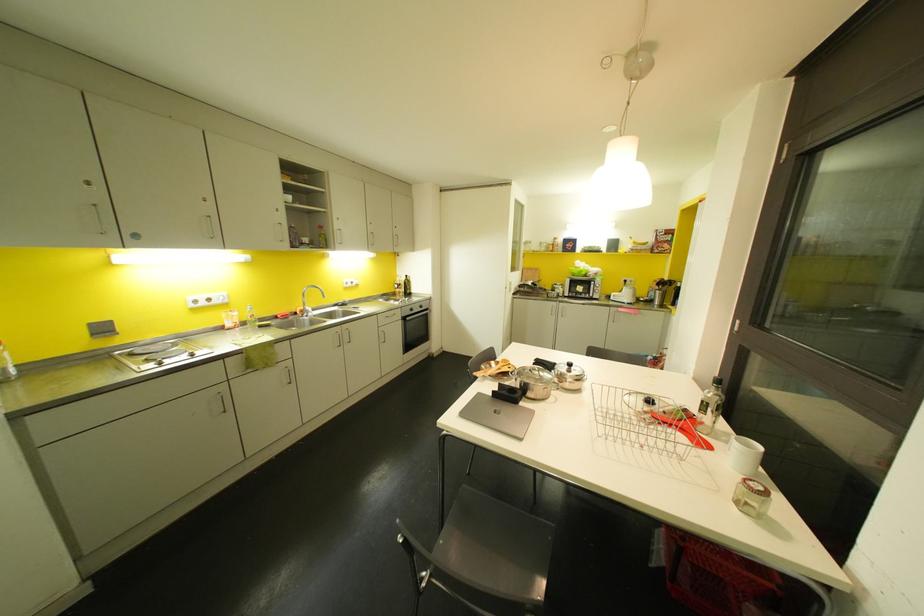
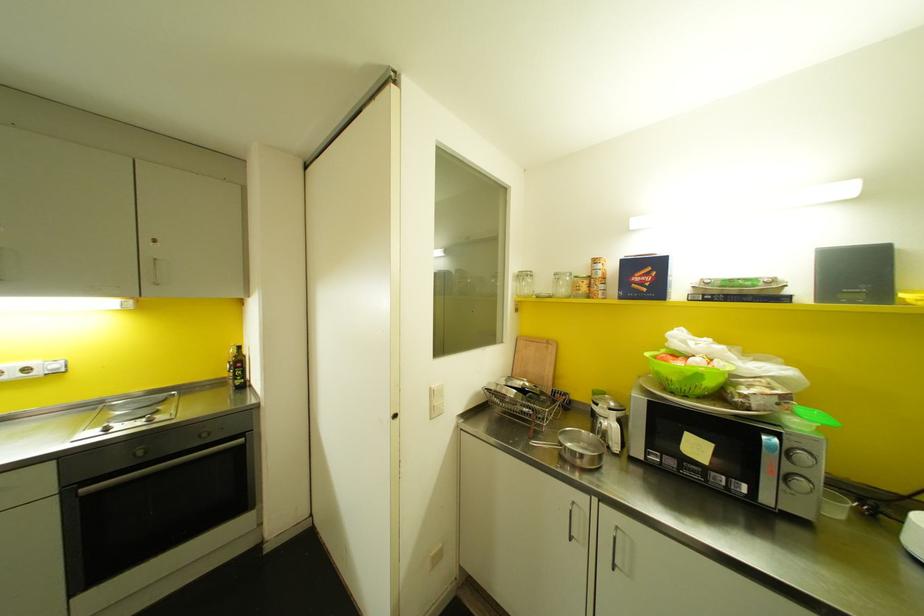
Where in the second image is the point corresponding to point 526,243 from the first image?

(520, 276)